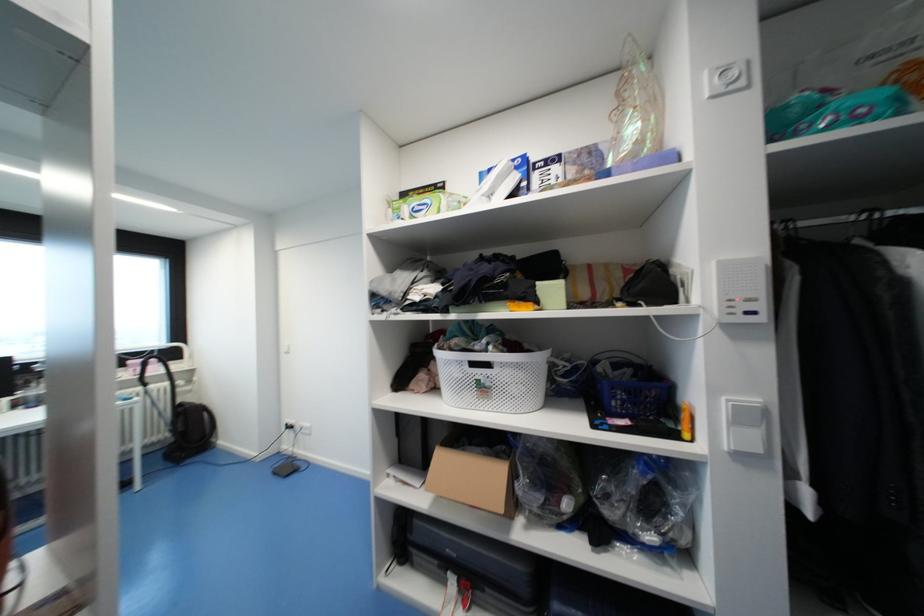
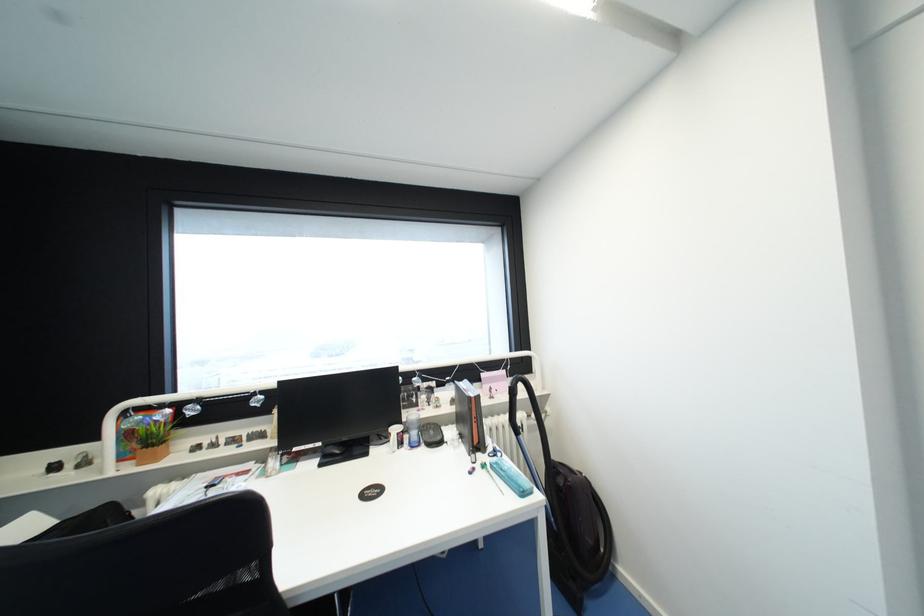
In the second image, find the point that corresponds to [134,363] in the first image.

(488, 376)